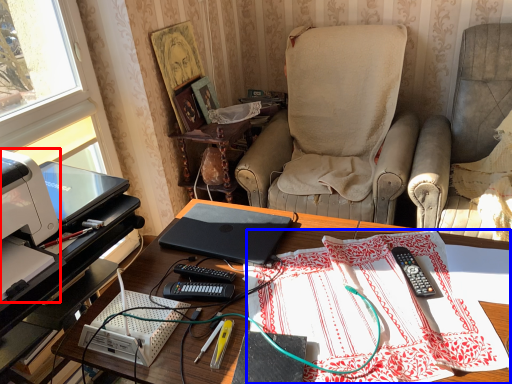
Question: Which object appears closest to the camera in this image, printer (highlighted by a red box) or tablecloth (highlighted by a blue box)?

Choices:
 (A) printer
 (B) tablecloth

Answer: (B)